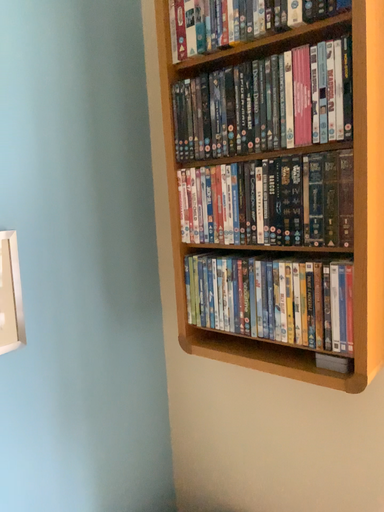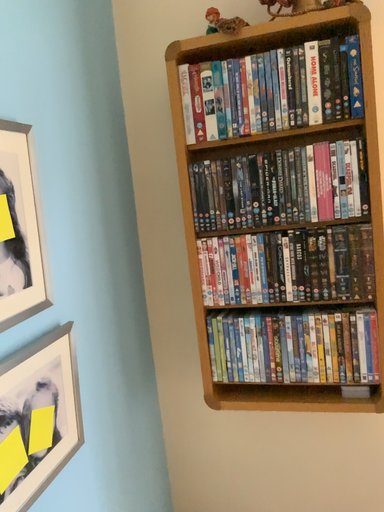
Question: How did the camera likely rotate when shooting the video?

Choices:
 (A) rotated right
 (B) rotated left

Answer: (A)